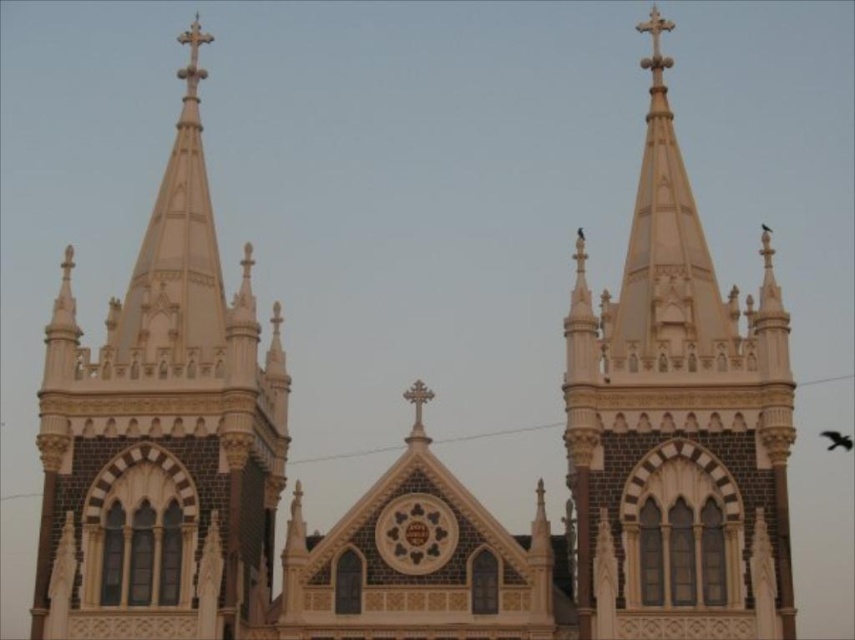
Question: Which point is farther to the camera?

Choices:
 (A) click(727, 360)
 (B) click(119, 490)

Answer: (B)

Question: Where is white stone spire at center located in relation to white stone steeple at upper center in the image?

Choices:
 (A) left
 (B) right

Answer: (A)

Question: Observing the image, what is the correct spatial positioning of white stone spire at center in reference to white stone steeple at upper center?

Choices:
 (A) below
 (B) above

Answer: (A)

Question: Among these points, which one is farthest from the camera?

Choices:
 (A) (122, 472)
 (B) (681, 163)

Answer: (B)

Question: Does white stone spire at center appear over white stone steeple at upper center?

Choices:
 (A) no
 (B) yes

Answer: (A)